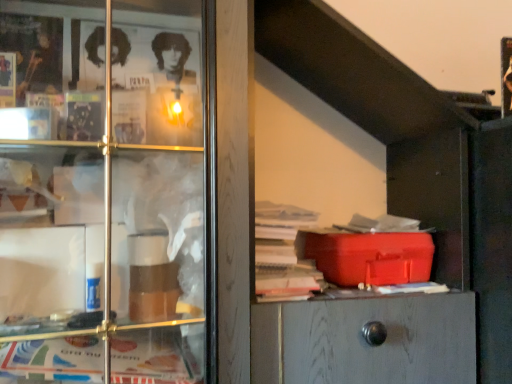
What do you see at coordinates (368, 256) in the screenshot?
I see `matte plastic storage box at center` at bounding box center [368, 256].

Identify the location of matte plastic storage box at center. The height and width of the screenshot is (384, 512). (368, 256).

This screenshot has height=384, width=512. What are the coordinates of `matte plastic storage box at center` in the screenshot? It's located at (368, 256).